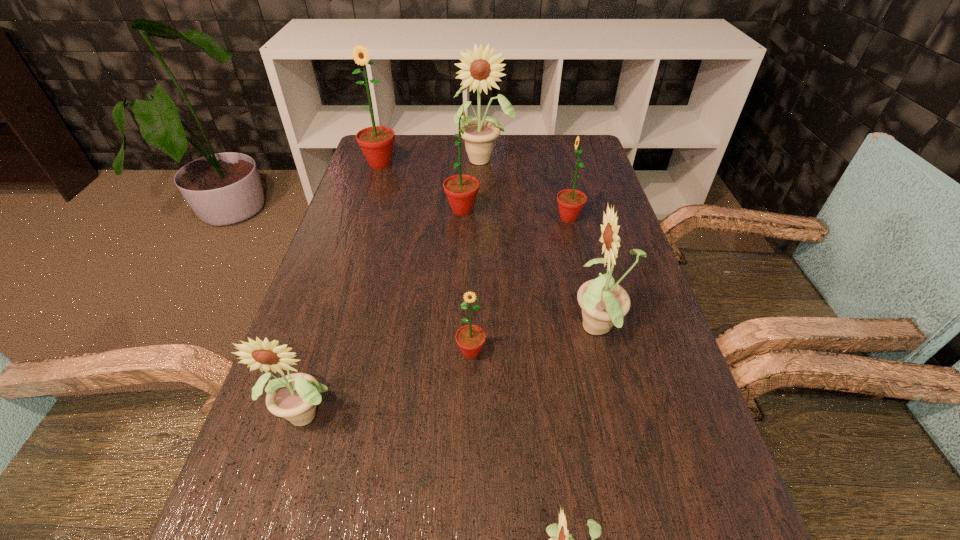
Identify the location of the biggest yellow sunflower. (479, 136).

You are a GUI agent. You are given a task and a screenshot of the screen. Output one action in this format:
    pyautogui.click(x=<x>, y=<y>)
    Task: Click on the biggest green sunflower
    Image resolution: width=960 pixels, height=540 pixels.
    Given the screenshot: What is the action you would take?
    pyautogui.click(x=376, y=142)

This screenshot has width=960, height=540. What are the coordinates of `the leftmost green sunflower` in the screenshot? It's located at (376, 142).

This screenshot has height=540, width=960. I want to click on the third smallest yellow sunflower, so click(604, 303).

The width and height of the screenshot is (960, 540). I want to click on the rightmost yellow sunflower, so click(x=604, y=303).

This screenshot has height=540, width=960. In order to click on the third smallest green sunflower in this screenshot , I will do `click(461, 190)`.

Locate an element on the screen. This screenshot has width=960, height=540. the rightmost green sunflower is located at coordinates (570, 201).

What are the coordinates of `the seventh farthest sunflower` in the screenshot? It's located at (294, 397).

Locate an element on the screen. Image resolution: width=960 pixels, height=540 pixels. the second nearest yellow sunflower is located at coordinates (294, 397).

Where is `the nearest green sunflower`? the nearest green sunflower is located at coordinates (470, 338).